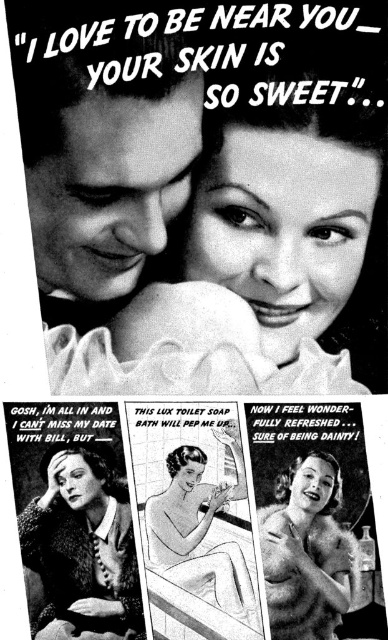
You are a store clerk organizing items for a display. You have the knitted sweater at lower left and the smooth porcelain soap at center. Which item should you place on the lower shelf if the lower shelf has limited space and can only accommodate smaller items?

The smooth porcelain soap at center should be placed on the lower shelf because it is smaller than the knitted sweater at lower left, which requires more space.